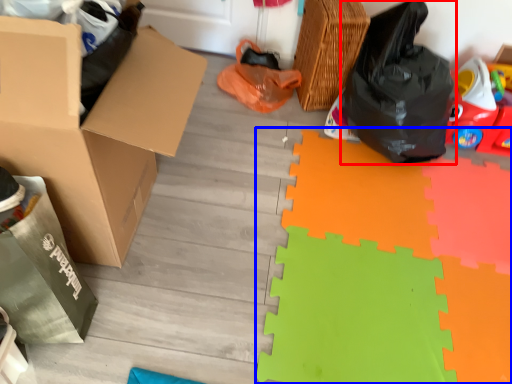
Question: Which object is closer to the camera taking this photo, plastic bag (highlighted by a red box) or doormat (highlighted by a blue box)?

Choices:
 (A) plastic bag
 (B) doormat

Answer: (B)